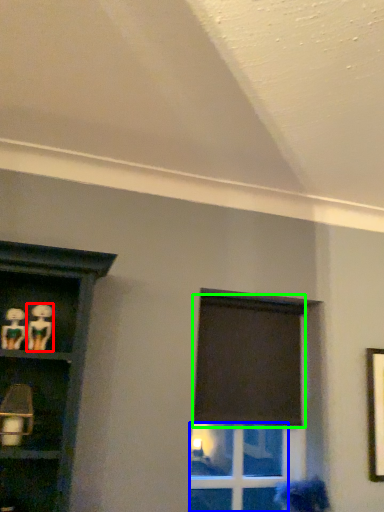
Question: Considering the real-world distances, which object is closest to woman (highlighted by a red box)? glass door (highlighted by a blue box) or curtain (highlighted by a green box).

Choices:
 (A) glass door
 (B) curtain

Answer: (B)